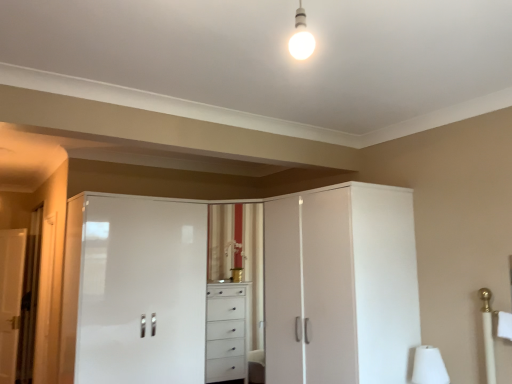
Question: Is the depth of white matte table lamp at lower right greater than that of white glossy door at left?

Choices:
 (A) yes
 (B) no

Answer: (B)

Question: Considering the relative sizes of white matte table lamp at lower right and white glossy door at left in the image provided, is white matte table lamp at lower right smaller than white glossy door at left?

Choices:
 (A) no
 (B) yes

Answer: (B)

Question: From the image's perspective, would you say white matte table lamp at lower right is positioned over white glossy door at left?

Choices:
 (A) yes
 (B) no

Answer: (A)

Question: Would you say white matte table lamp at lower right is a long distance from white glossy door at left?

Choices:
 (A) no
 (B) yes

Answer: (B)

Question: Is white matte table lamp at lower right with white glossy door at left?

Choices:
 (A) yes
 (B) no

Answer: (B)

Question: Is point pos(88,274) closer or farther from the camera than point pos(350,213)?

Choices:
 (A) farther
 (B) closer

Answer: (A)

Question: Is white glossy cabinet at center, acting as the second screen door starting from the right, spatially inside white glossy cabinet at center, the second screen door positioned from the left, or outside of it?

Choices:
 (A) outside
 (B) inside

Answer: (A)

Question: Based on their sizes in the image, would you say white glossy cabinet at center, the 1th screen door viewed from the left, is bigger or smaller than white glossy cabinet at center, the second screen door positioned from the left?

Choices:
 (A) small
 (B) big

Answer: (B)

Question: Relative to white glossy cabinet at center, the second screen door positioned from the left, is white glossy cabinet at center, the 1th screen door viewed from the left, in front or behind?

Choices:
 (A) behind
 (B) front

Answer: (A)

Question: In the image, is white glossy door at left on the left side or the right side of white glossy cabinet at center, the 1th screen door viewed from the left?

Choices:
 (A) left
 (B) right

Answer: (A)

Question: From the image's perspective, is white glossy door at left located above or below white glossy cabinet at center, the 1th screen door viewed from the left?

Choices:
 (A) below
 (B) above

Answer: (A)

Question: Considering the positions of white glossy door at left and white glossy cabinet at center, acting as the second screen door starting from the right, in the image, is white glossy door at left taller or shorter than white glossy cabinet at center, acting as the second screen door starting from the right,?

Choices:
 (A) short
 (B) tall

Answer: (B)

Question: Is white glossy door at left in front of or behind white glossy cabinet at center, acting as the second screen door starting from the right, in the image?

Choices:
 (A) behind
 (B) front

Answer: (A)

Question: Is point tap(5, 253) positioned closer to the camera than point tap(327, 369)?

Choices:
 (A) farther
 (B) closer

Answer: (A)

Question: From the image's perspective, is white glossy door at left positioned above or below white glossy cabinet at center, which is the first screen door from right to left?

Choices:
 (A) below
 (B) above

Answer: (A)